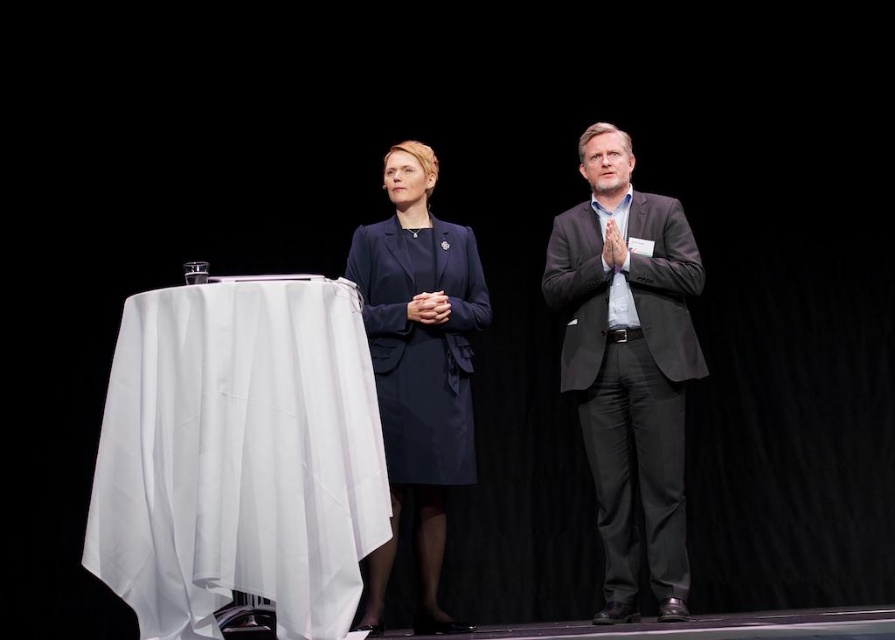
In the scene shown: You are a photographer at a formal event. You need to capture a closeup shot of both the dark gray suit at center and the navy blue fabric coat at center. Given their sizes, which one should you focus on first to ensure both are in frame?

The dark gray suit at center is larger in size than the navy blue fabric coat at center, so you should focus on the dark gray suit at center first to ensure it fits within the frame before adjusting for the smaller navy blue fabric coat at center.